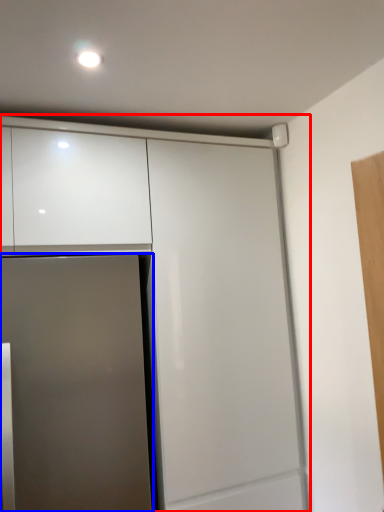
Question: Which of the following is the farthest to the observer, cabinetry (highlighted by a red box) or door (highlighted by a blue box)?

Choices:
 (A) cabinetry
 (B) door

Answer: (A)